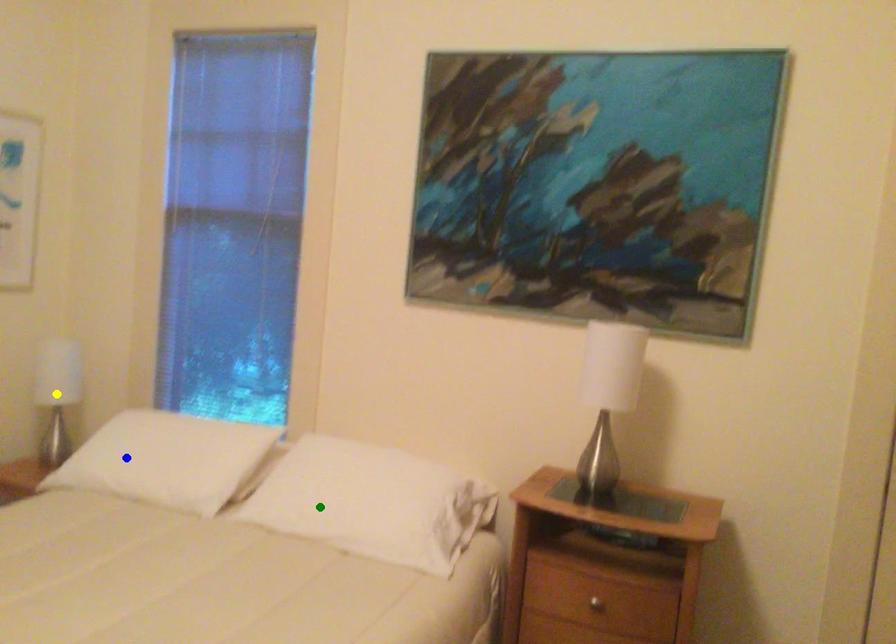
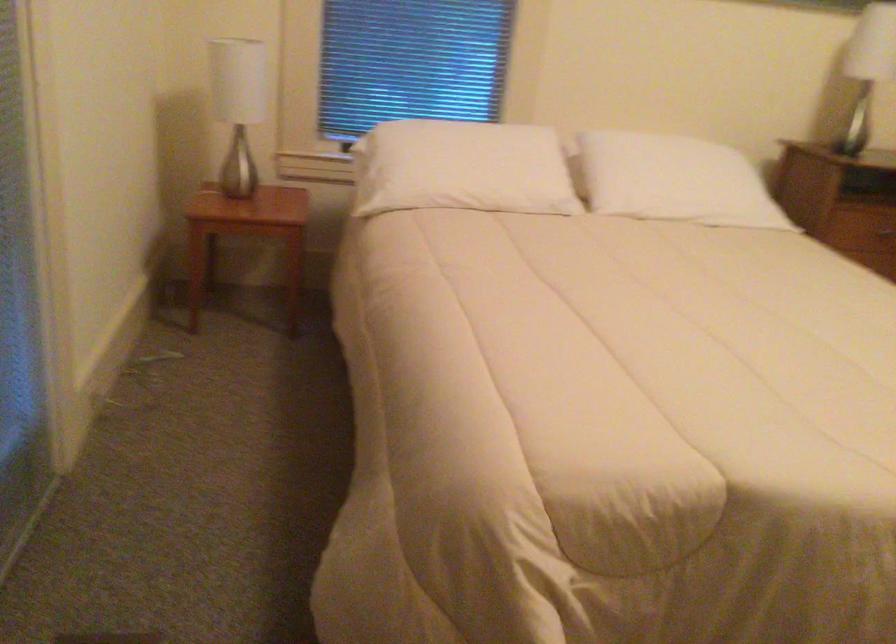
I am providing you with two images of the same scene from different viewpoints. Three points are marked in image1. Which point corresponds to a part or object that is occluded in image2?In image1, three points are marked. Which of them correspond to a part or object that is occluded in image2?Among the three points shown in image1, which one corresponds to a part or object that is no longer visible due to occlusion in image2?

yellow point cannot be seen in image2.